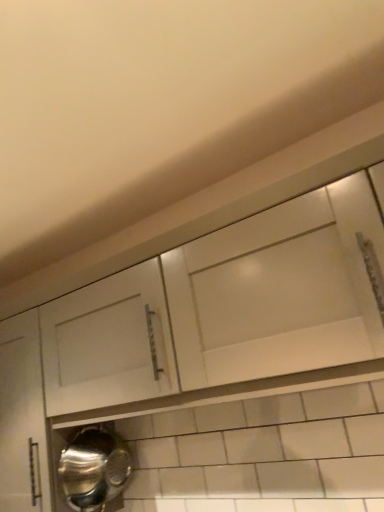
Question: Is white matte cabinet at upper center facing towards shiny metallic water heater at lower left?

Choices:
 (A) no
 (B) yes

Answer: (A)

Question: Considering the relative sizes of white matte cabinet at upper center and shiny metallic water heater at lower left in the image provided, is white matte cabinet at upper center thinner than shiny metallic water heater at lower left?

Choices:
 (A) no
 (B) yes

Answer: (A)

Question: From the image's perspective, is white matte cabinet at upper center under shiny metallic water heater at lower left?

Choices:
 (A) no
 (B) yes

Answer: (A)

Question: Considering the relative sizes of white matte cabinet at upper center and shiny metallic water heater at lower left in the image provided, is white matte cabinet at upper center wider than shiny metallic water heater at lower left?

Choices:
 (A) yes
 (B) no

Answer: (A)

Question: Is shiny metallic water heater at lower left surrounded by white matte cabinet at upper center?

Choices:
 (A) yes
 (B) no

Answer: (B)

Question: Is white matte cabinet at upper center shorter than shiny metallic water heater at lower left?

Choices:
 (A) no
 (B) yes

Answer: (A)

Question: Can you confirm if shiny metallic water heater at lower left is positioned to the right of white matte cabinet at upper center?

Choices:
 (A) yes
 (B) no

Answer: (B)

Question: Is shiny metallic water heater at lower left thinner than white matte cabinet at upper center?

Choices:
 (A) yes
 (B) no

Answer: (A)

Question: Does shiny metallic water heater at lower left have a smaller size compared to white matte cabinet at upper center?

Choices:
 (A) yes
 (B) no

Answer: (A)

Question: Can you confirm if shiny metallic water heater at lower left is shorter than white matte cabinet at upper center?

Choices:
 (A) no
 (B) yes

Answer: (B)

Question: From a real-world perspective, is shiny metallic water heater at lower left physically above white matte cabinet at upper center?

Choices:
 (A) yes
 (B) no

Answer: (B)

Question: Is shiny metallic water heater at lower left oriented away from white matte cabinet at upper center?

Choices:
 (A) no
 (B) yes

Answer: (A)

Question: From their relative heights in the image, would you say white matte cabinet at upper center is taller or shorter than shiny metallic water heater at lower left?

Choices:
 (A) tall
 (B) short

Answer: (A)